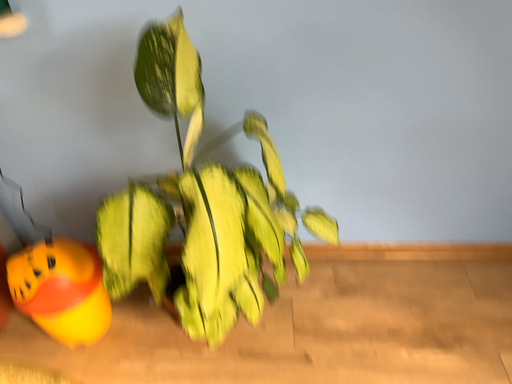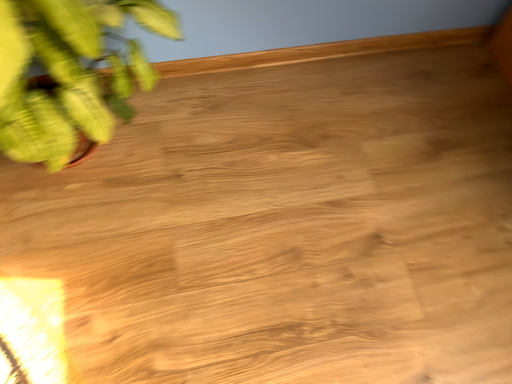
Question: How did the camera likely rotate when shooting the video?

Choices:
 (A) rotated downward
 (B) rotated upward

Answer: (A)